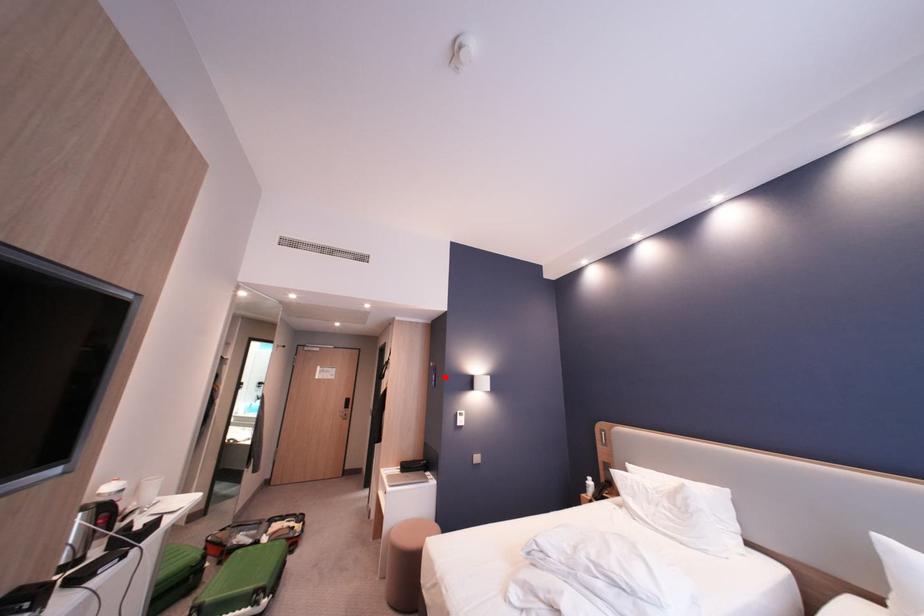
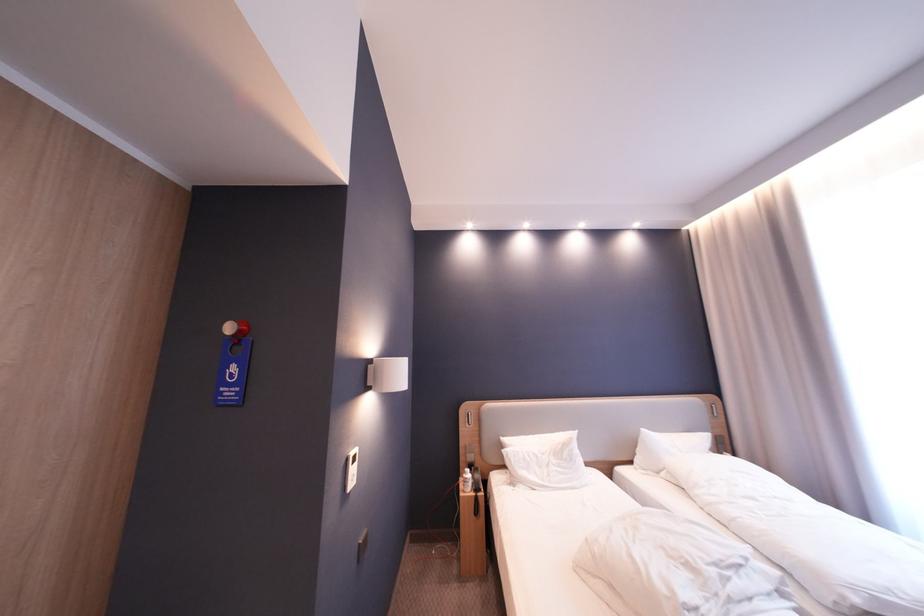
Find the pixel in the second image that matches the highlighted location in the first image.

(245, 370)